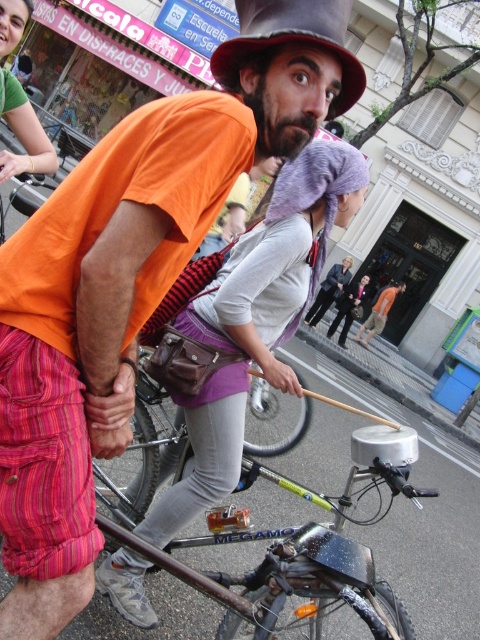
You are a photographer trying to capture a closeup of the shiny metallic hat at center and the green fabric shirt at upper left in the scene. Given that your camera can only focus on objects within a 100 cm width, will both items fit within the frame?

The shiny metallic hat at center has a larger width than the green fabric shirt at upper left, but the exact widths aren

You are a delivery person who needs to carry a package that is 1.2 meters wide. You see the silver metallic bicycle at center and the shiny metallic hat at center in the image. Can the package fit between them horizontally?

The silver metallic bicycle at center might be wider than shiny metallic hat at center, so the package that is 1.2 meters wide may not fit between them horizontally if the distance between them is less than 1.2 meters. However, since the exact distance isn not provided, it is uncertain.

Based on the scene description, which object is larger in size between the silver metallic bicycle at center and the green fabric shirt at upper left?

The silver metallic bicycle at center is bigger than the green fabric shirt at upper left according to the description.